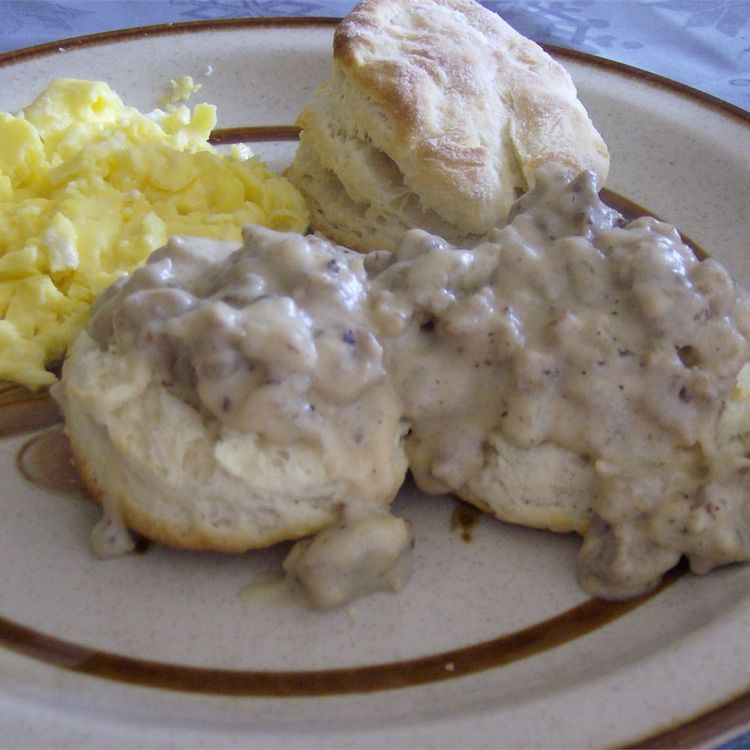
Identify the location of tablecloth. Image resolution: width=750 pixels, height=750 pixels. (656, 26).